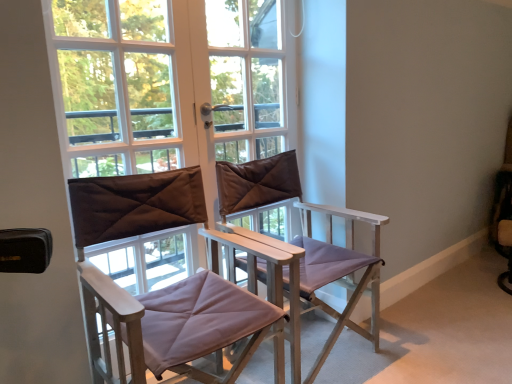
Question: Is transparent glass window at center to the left or to the right of purple fabric chair at center, acting as the 1th chair starting from the right, in the image?

Choices:
 (A) right
 (B) left

Answer: (B)

Question: Is transparent glass window at center in front of or behind purple fabric chair at center, acting as the 1th chair starting from the right, in the image?

Choices:
 (A) front
 (B) behind

Answer: (B)

Question: Estimate the real-world distances between objects in this image. Which object is closer to the matte brown director's chair at center, the second chair in the right-to-left sequence?

Choices:
 (A) transparent glass window at center
 (B) purple fabric chair at center, which is the 2th chair in left-to-right order

Answer: (A)

Question: Which object is positioned closest to the transparent glass window at center?

Choices:
 (A) purple fabric chair at center, acting as the 1th chair starting from the right
 (B) matte brown director's chair at center, arranged as the 1th chair when viewed from the left

Answer: (B)